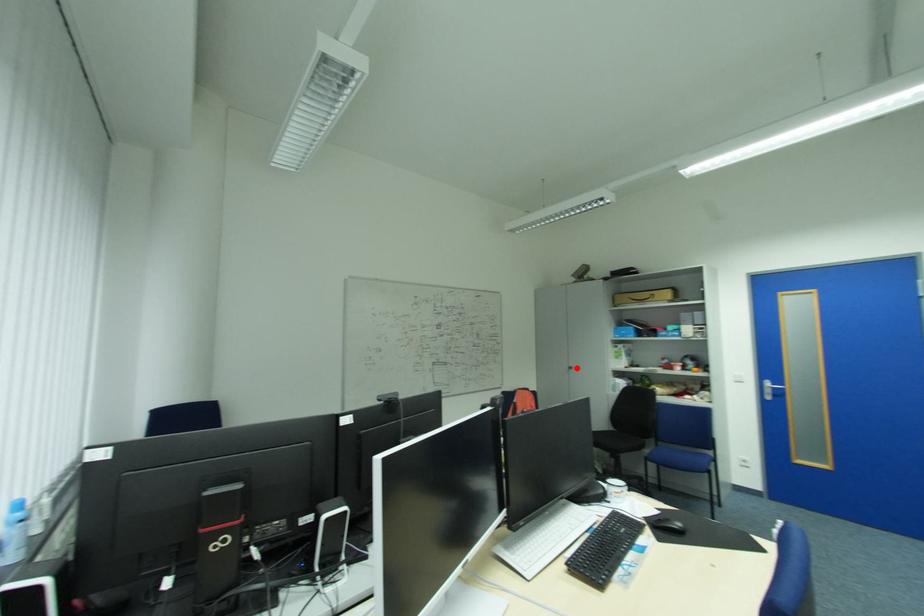
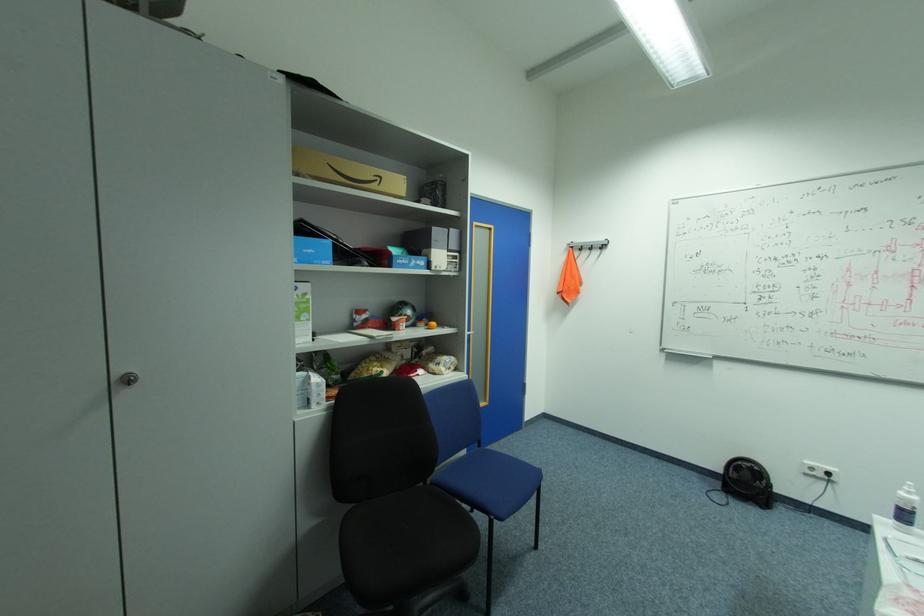
In the second image, find the point that corresponds to the highlighted location in the first image.

(137, 379)